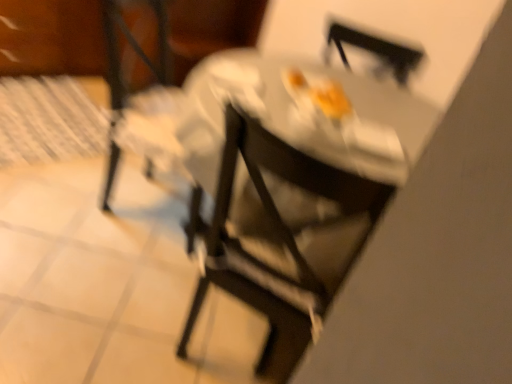
Question: From the image's perspective, is matte black chair at center, acting as the 2th chair starting from the right, on top of metallic silver chair at center, the 1th chair viewed from the right?

Choices:
 (A) yes
 (B) no

Answer: (A)

Question: Is matte black chair at center, which is the first chair in left-to-right order, at the right side of metallic silver chair at center, the 1th chair viewed from the right?

Choices:
 (A) no
 (B) yes

Answer: (A)

Question: Is matte black chair at center, which is the first chair in left-to-right order, smaller than metallic silver chair at center, the 1th chair viewed from the right?

Choices:
 (A) no
 (B) yes

Answer: (A)

Question: Does matte black chair at center, acting as the 2th chair starting from the right, lie behind metallic silver chair at center, the 1th chair viewed from the right?

Choices:
 (A) no
 (B) yes

Answer: (B)

Question: Considering the relative positions of matte black chair at center, which is the first chair in left-to-right order, and metallic silver chair at center, the 2th chair viewed from the left, in the image provided, is matte black chair at center, which is the first chair in left-to-right order, in front of metallic silver chair at center, the 2th chair viewed from the left,?

Choices:
 (A) no
 (B) yes

Answer: (A)

Question: Can you confirm if matte black chair at center, which is the first chair in left-to-right order, is thinner than metallic silver chair at center, the 2th chair viewed from the left?

Choices:
 (A) no
 (B) yes

Answer: (A)

Question: Are wooden table at upper left and matte black chair at center, which is the first chair in left-to-right order, far apart?

Choices:
 (A) yes
 (B) no

Answer: (B)

Question: Is the position of wooden table at upper left less distant than that of matte black chair at center, acting as the 2th chair starting from the right?

Choices:
 (A) no
 (B) yes

Answer: (A)

Question: Is matte black chair at center, acting as the 2th chair starting from the right, at the back of wooden table at upper left?

Choices:
 (A) yes
 (B) no

Answer: (B)

Question: From a real-world perspective, is wooden table at upper left physically above matte black chair at center, which is the first chair in left-to-right order?

Choices:
 (A) yes
 (B) no

Answer: (B)

Question: From the image's perspective, is wooden table at upper left on top of matte black chair at center, acting as the 2th chair starting from the right?

Choices:
 (A) no
 (B) yes

Answer: (B)

Question: Are wooden table at upper left and matte black chair at center, which is the first chair in left-to-right order, beside each other?

Choices:
 (A) no
 (B) yes

Answer: (A)

Question: Is metallic silver chair at center, the 1th chair viewed from the right, outside of wooden table at upper left?

Choices:
 (A) yes
 (B) no

Answer: (A)